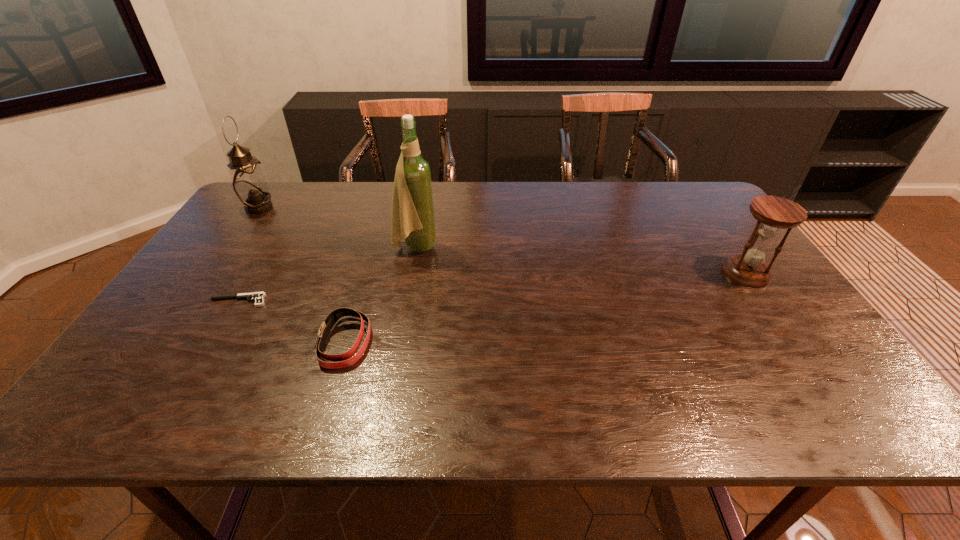
Locate an element on the screen. blank space at the far edge is located at coordinates (626, 210).

The image size is (960, 540). I want to click on vacant area at the near edge, so click(x=660, y=410).

This screenshot has height=540, width=960. Identify the location of free region at the left edge. (184, 282).

Find the location of `free region at the right edge of the desktop`. free region at the right edge of the desktop is located at coordinates (775, 348).

Locate an element on the screen. Image resolution: width=960 pixels, height=540 pixels. vacant space at the far left corner is located at coordinates (240, 217).

Image resolution: width=960 pixels, height=540 pixels. I want to click on free space at the far right corner, so click(x=683, y=187).

Where is `vacant space at the near right corner of the desktop`? Image resolution: width=960 pixels, height=540 pixels. vacant space at the near right corner of the desktop is located at coordinates (809, 404).

Image resolution: width=960 pixels, height=540 pixels. Identify the location of vacant area that lies between the hourglass and the farthest object. (503, 240).

This screenshot has height=540, width=960. Find the location of `vacant space that's between the oil lamp and the nearest object`. vacant space that's between the oil lamp and the nearest object is located at coordinates (301, 275).

The image size is (960, 540). What are the coordinates of `vacant region between the shortest object and the second tallest object` in the screenshot? It's located at (249, 254).